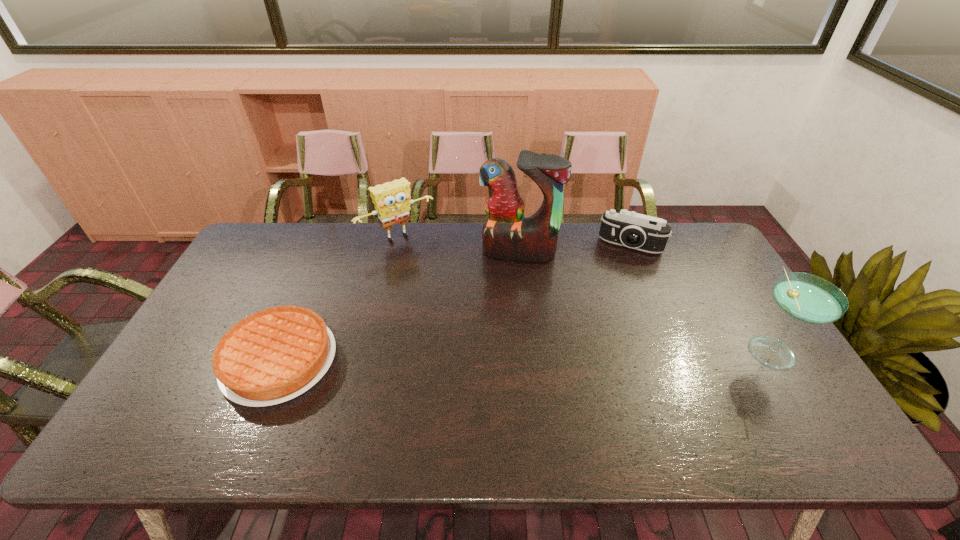
Identify the location of vacant point located between the rightmost object and the sponge. (584, 293).

Locate an element on the screen. This screenshot has height=540, width=960. vacant space in between the parrot and the pie is located at coordinates (399, 306).

Locate an element on the screen. This screenshot has width=960, height=540. vacant space in between the camera and the third object from left to right is located at coordinates (574, 248).

Locate an element on the screen. vacant region between the shortest object and the rightmost object is located at coordinates (524, 355).

The image size is (960, 540). I want to click on vacant area that lies between the second shortest object and the martini, so click(700, 297).

You are a GUI agent. You are given a task and a screenshot of the screen. Output one action in this format:
    pyautogui.click(x=<x>, y=<y>)
    Task: Click on the empty space that is in between the parrot and the sponge
    The height and width of the screenshot is (540, 960).
    Given the screenshot: What is the action you would take?
    pyautogui.click(x=458, y=245)

At what (x,y) coordinates should I click in order to perform the action: click on empty space that is in between the second shortest object and the rightmost object. Please return your answer as a coordinate pair (x, y). The width and height of the screenshot is (960, 540). Looking at the image, I should click on (700, 297).

You are a GUI agent. You are given a task and a screenshot of the screen. Output one action in this format:
    pyautogui.click(x=<x>, y=<y>)
    Task: Click on the empty space between the parrot and the second shortest object
    The image size is (960, 540).
    Given the screenshot: What is the action you would take?
    pyautogui.click(x=574, y=248)

Identify the location of free space between the camera and the shortest object. (455, 302).

Point out which object is positioned as the fourth nearest to the parrot. Please provide its 2D coordinates. Your answer should be formatted as a tuple, i.e. [(x, y)], where the tuple contains the x and y coordinates of a point satisfying the conditions above.

[(807, 298)]